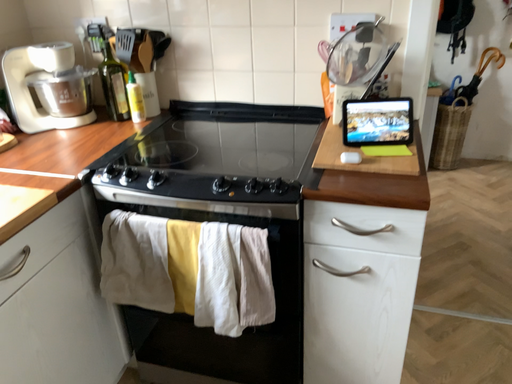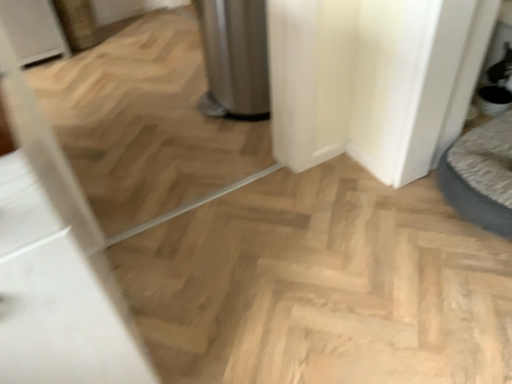
Question: Which way did the camera rotate in the video?

Choices:
 (A) rotated left
 (B) rotated right

Answer: (B)